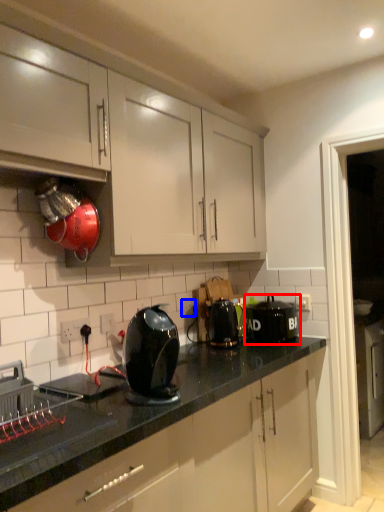
Question: Which object appears closest to the camera in this image, kitchen appliance (highlighted by a red box) or electric outlet (highlighted by a blue box)?

Choices:
 (A) kitchen appliance
 (B) electric outlet

Answer: (A)